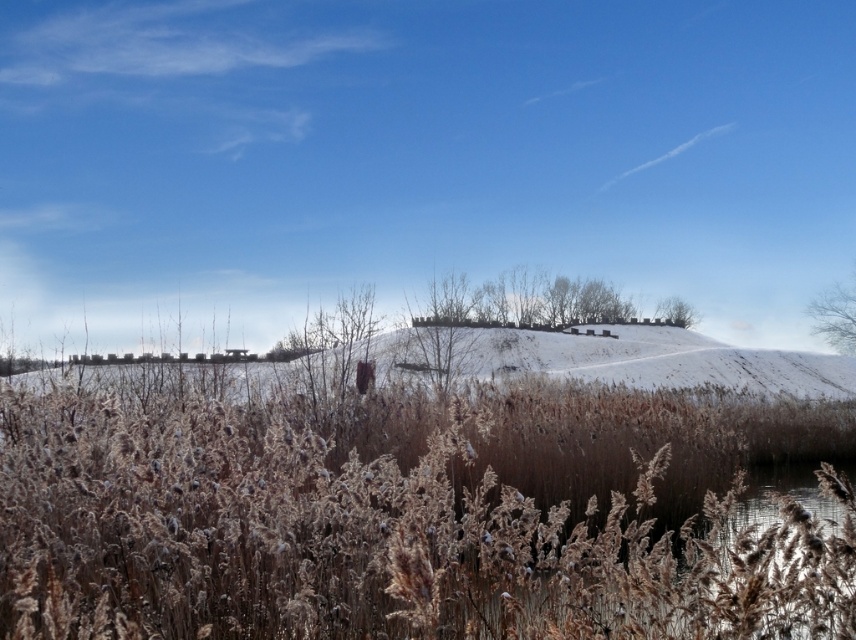
Which is more to the right, bare branches at upper right or green leafy tree at upper center?

bare branches at upper right

Find the location of a particular element. The image size is (856, 640). bare branches at upper right is located at coordinates (835, 316).

What are the coordinates of `bare branches at upper right` in the screenshot? It's located at (835, 316).